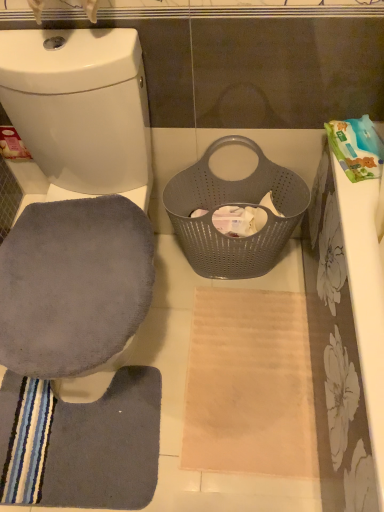
Question: Can you confirm if gray fabric toilet seat at left is taller than gray suede swivel chair at left?

Choices:
 (A) yes
 (B) no

Answer: (A)

Question: Can you confirm if gray fabric toilet seat at left is shorter than gray suede swivel chair at left?

Choices:
 (A) no
 (B) yes

Answer: (A)

Question: From the image's perspective, does gray fabric toilet seat at left appear higher than gray suede swivel chair at left?

Choices:
 (A) no
 (B) yes

Answer: (B)

Question: Can you confirm if gray fabric toilet seat at left is bigger than gray suede swivel chair at left?

Choices:
 (A) yes
 (B) no

Answer: (A)

Question: Could you tell me if gray fabric toilet seat at left is facing gray suede swivel chair at left?

Choices:
 (A) yes
 (B) no

Answer: (A)

Question: Considering the relative sizes of gray fabric toilet seat at left and gray suede swivel chair at left in the image provided, is gray fabric toilet seat at left thinner than gray suede swivel chair at left?

Choices:
 (A) yes
 (B) no

Answer: (B)

Question: Does gray suede swivel chair at left turn towards gray perforated basket at center?

Choices:
 (A) no
 (B) yes

Answer: (A)

Question: Does gray suede swivel chair at left appear on the right side of gray perforated basket at center?

Choices:
 (A) no
 (B) yes

Answer: (A)

Question: Does gray suede swivel chair at left have a greater height compared to gray perforated basket at center?

Choices:
 (A) yes
 (B) no

Answer: (B)

Question: From a real-world perspective, is gray suede swivel chair at left physically below gray perforated basket at center?

Choices:
 (A) yes
 (B) no

Answer: (B)

Question: Is gray perforated basket at center located within gray suede swivel chair at left?

Choices:
 (A) no
 (B) yes

Answer: (A)

Question: Is gray perforated basket at center at the back of gray suede swivel chair at left?

Choices:
 (A) no
 (B) yes

Answer: (A)

Question: Is gray suede swivel chair at left far from gray fabric toilet seat at left?

Choices:
 (A) yes
 (B) no

Answer: (B)